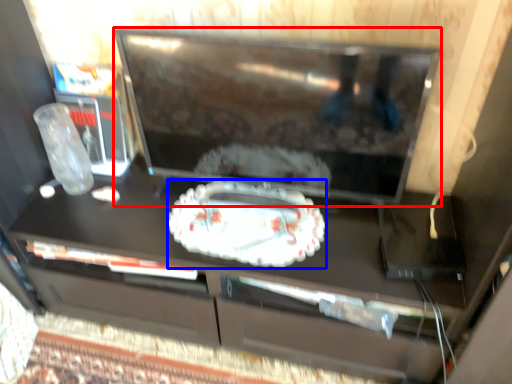
Question: Among these objects, which one is nearest to the camera, television (highlighted by a red box) or cake (highlighted by a blue box)?

Choices:
 (A) television
 (B) cake

Answer: (A)